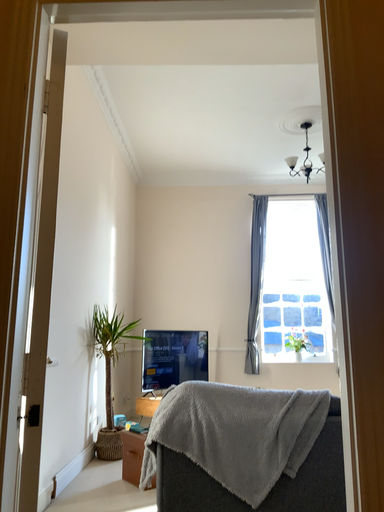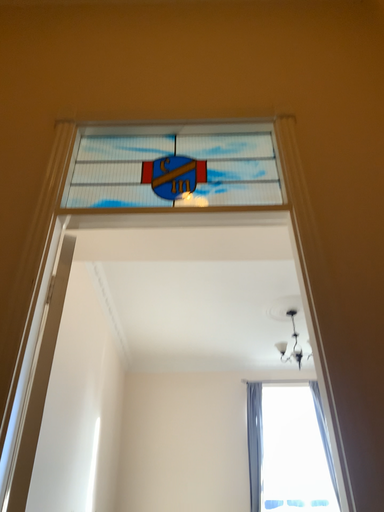
Question: Which way did the camera rotate in the video?

Choices:
 (A) rotated upward
 (B) rotated downward

Answer: (A)